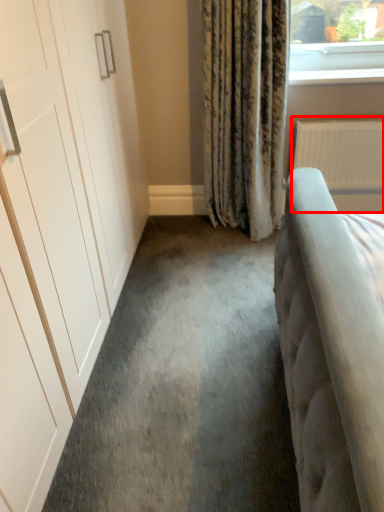
Question: From the image's perspective, what is the correct spatial positioning of radiator (annotated by the red box) in reference to window sill?

Choices:
 (A) below
 (B) above

Answer: (A)